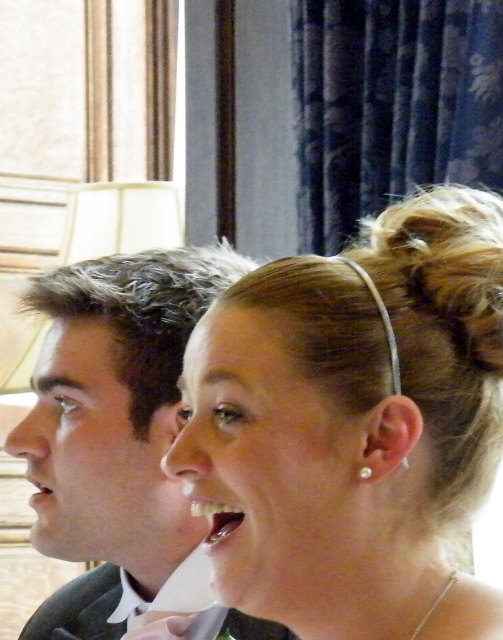
You are a photographer at a formal event. You notice two sets of teeth in the scene. The first set, white glossy teeth at center, belongs to the person speaking. The second set, matte white teeth at lower left, belongs to someone else. Which set of teeth appears higher in the image?

The white glossy teeth at center appears higher in the image than the matte white teeth at lower left because it is located above it.

You are a photographer setting up for a formal event. You need to ensure that the matte black suit at left and the matte white teeth at lower left are both visible in your photo. Based on their positions, which object is wider and thus requires more space in the frame?

The matte black suit at left is wider than the matte white teeth at lower left, so it requires more space in the frame to ensure visibility.

You are a photographer at a formal event. You need to capture a closeup shot of the white glossy teeth at center without the matte silver headband at upper center appearing in the frame. Is this possible given their positions?

The matte silver headband at upper center might be wider than white glossy teeth at center, so it could potentially block part of the teeth if positioned too close. Adjust the camera angle slightly downward to focus solely on the white glossy teeth at center while avoiding the headband.